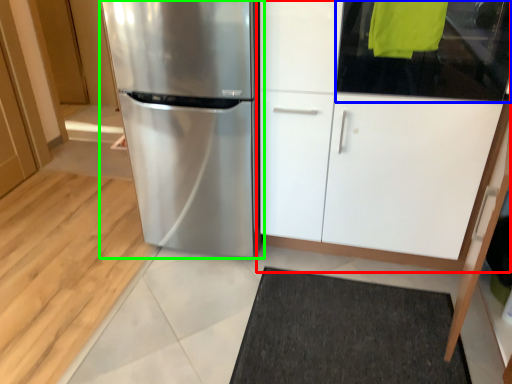
Question: Which is nearer to the cabinetry (highlighted by a red box)? glass door (highlighted by a blue box) or refrigerator (highlighted by a green box).

Choices:
 (A) glass door
 (B) refrigerator

Answer: (A)